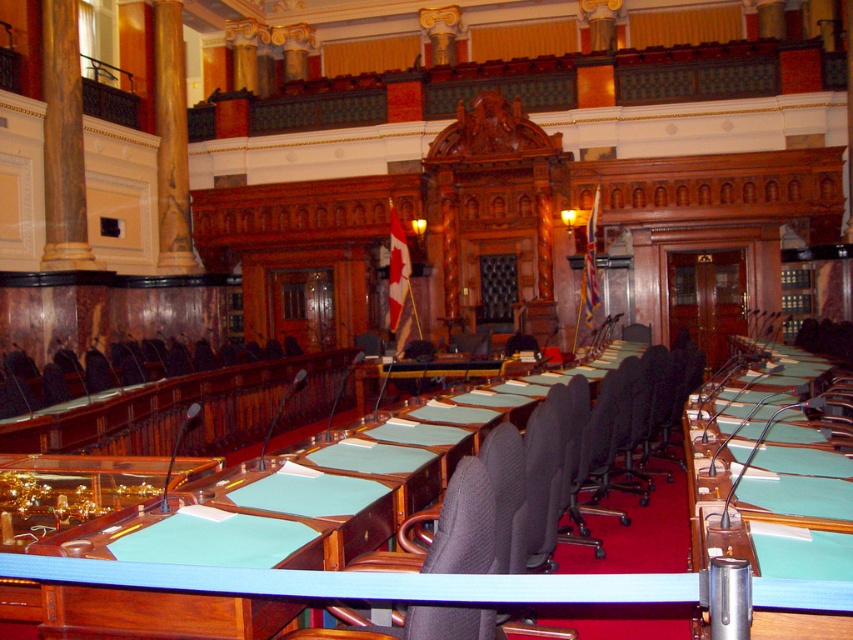
From the picture: Is green wood table at center positioned at the back of green felt table at center?

No.

Does green wood table at center have a greater height compared to green felt table at center?

No, green wood table at center is not taller than green felt table at center.

Where is `green wood table at center`? The width and height of the screenshot is (853, 640). green wood table at center is located at coordinates (161, 417).

Can you confirm if brown polished wood column at left is bigger than matte black chair at left?

Yes, brown polished wood column at left is bigger than matte black chair at left.

Does brown polished wood column at left appear on the left side of matte black chair at left?

Yes, brown polished wood column at left is to the left of matte black chair at left.

This screenshot has width=853, height=640. I want to click on brown polished wood column at left, so click(x=62, y=140).

Between green wood table at center and black fabric chair at center, which one is positioned lower?

Positioned lower is green wood table at center.

Is green wood table at center further to the viewer compared to black fabric chair at center?

That is True.

Is point (276, 444) farther from viewer compared to point (300, 634)?

Yes.

The height and width of the screenshot is (640, 853). In order to click on green wood table at center in this screenshot , I will do `click(161, 417)`.